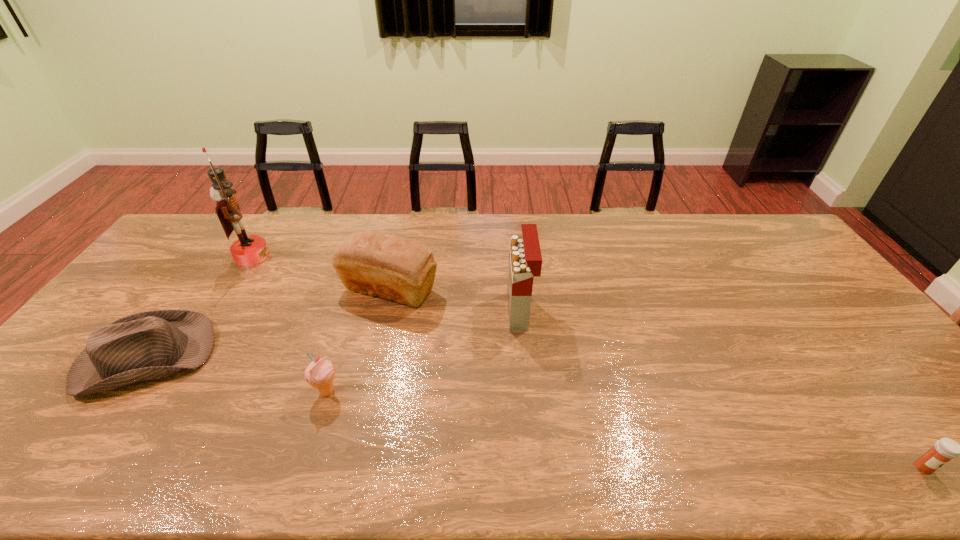
The image size is (960, 540). Find the location of `the tallest object`. the tallest object is located at coordinates (247, 250).

The image size is (960, 540). I want to click on the farthest object, so (247, 250).

Locate an element on the screen. This screenshot has height=540, width=960. the second object from right to left is located at coordinates (525, 260).

Find the location of a particular element. The image size is (960, 540). cigarette case is located at coordinates (525, 260).

Locate an element on the screen. The height and width of the screenshot is (540, 960). the third tallest object is located at coordinates (392, 267).

Find the location of a particular element. The height and width of the screenshot is (540, 960). icecream is located at coordinates (320, 374).

Find the location of a particular element. This screenshot has height=540, width=960. fedora is located at coordinates (149, 345).

Locate an element on the screen. the shortest object is located at coordinates (945, 449).

This screenshot has height=540, width=960. Identify the location of the nearest object. (945, 449).

The image size is (960, 540). In order to click on vacant space located 0.300m on the front-facing side of the nutcracker in this screenshot , I will do [356, 256].